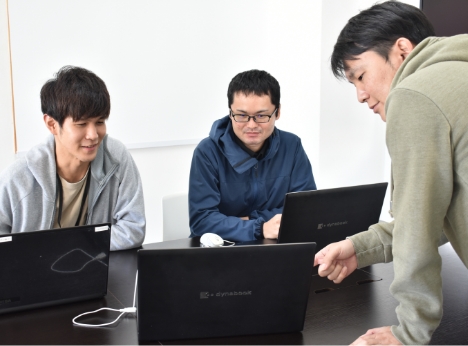
Find the location of `table`. table is located at coordinates (349, 322).